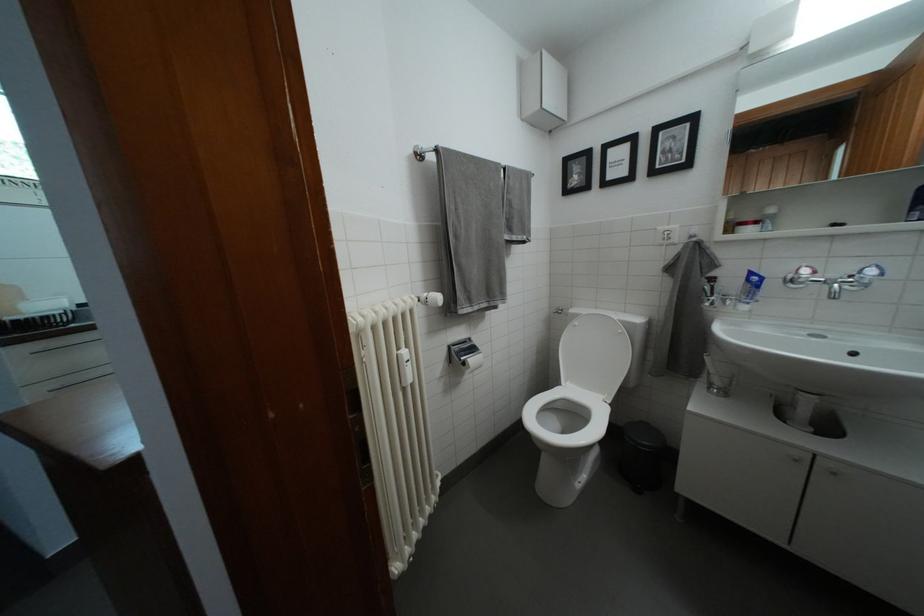
Find the location of a particular element. The image size is (924, 616). radiator thermostat knob is located at coordinates (405, 367).